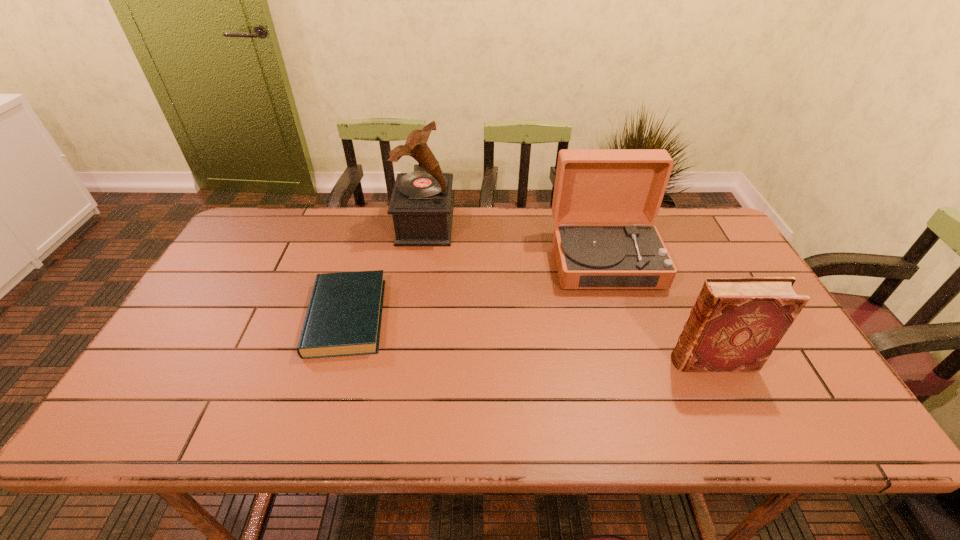
This screenshot has width=960, height=540. Identify the location of the left phonograph record. (420, 205).

Where is `the tallest object`? This screenshot has height=540, width=960. the tallest object is located at coordinates (420, 205).

Image resolution: width=960 pixels, height=540 pixels. Find the location of `the shorter phonograph record`. the shorter phonograph record is located at coordinates (592, 186).

In order to click on the right book in this screenshot , I will do `click(736, 323)`.

Locate an element on the screen. the third tallest object is located at coordinates (736, 323).

Where is `the shortest object`? the shortest object is located at coordinates (344, 314).

Image resolution: width=960 pixels, height=540 pixels. Find the location of `the shorter book`. the shorter book is located at coordinates (x=344, y=314).

Find the location of a particular element. Image resolution: width=960 pixels, height=540 pixels. free region located at the horn opening of the tallest object is located at coordinates (495, 226).

Locate an element on the screen. This screenshot has height=540, width=960. free space located on the face of the right phonograph record is located at coordinates (638, 366).

Locate an element on the screen. The image size is (960, 540). free space located on the spine side of the second shortest object is located at coordinates (544, 361).